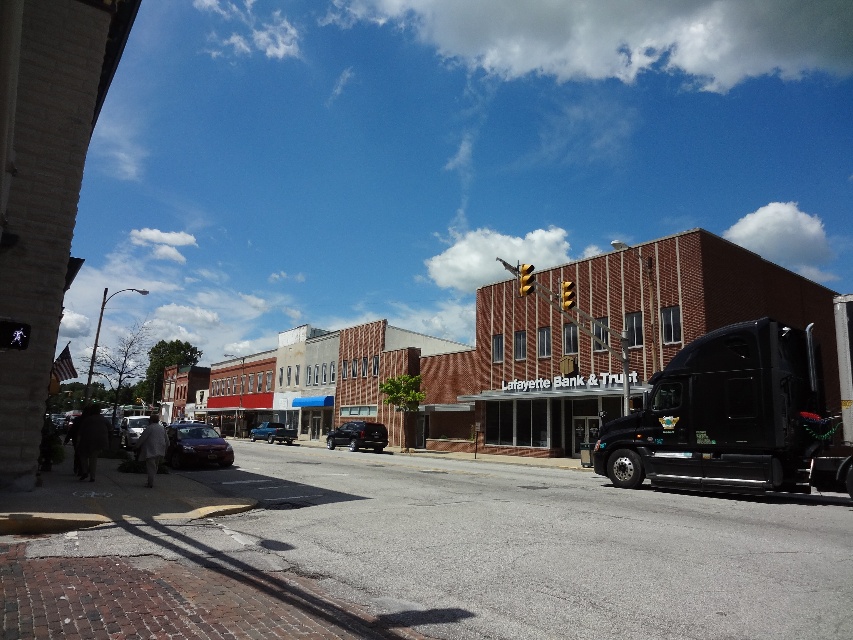
Can you confirm if satin black suv at center is positioned to the right of metallic blue truck at center?

Yes, satin black suv at center is to the right of metallic blue truck at center.

In the scene shown: Does satin black suv at center appear under metallic blue truck at center?

Actually, satin black suv at center is above metallic blue truck at center.

Measure the distance between point (337, 435) and camera.

Point (337, 435) and camera are 34.86 meters apart from each other.

Identify the location of satin black suv at center. This screenshot has height=640, width=853. (358, 435).

Looking at this image, who is positioned more to the left, shiny dark red sedan at center or shiny black sedan at lower left?

From the viewer's perspective, shiny black sedan at lower left appears more on the left side.

Does shiny dark red sedan at center have a lesser height compared to shiny black sedan at lower left?

Yes.

Image resolution: width=853 pixels, height=640 pixels. What do you see at coordinates (196, 445) in the screenshot?
I see `shiny dark red sedan at center` at bounding box center [196, 445].

Locate an element on the screen. shiny dark red sedan at center is located at coordinates (196, 445).

Can you confirm if black glossy trailer truck at right is thinner than metallic blue truck at center?

Yes.

Between black glossy trailer truck at right and metallic blue truck at center, which one is positioned lower?

metallic blue truck at center

Is point (692, 342) positioned after point (276, 435)?

No, (692, 342) is closer to viewer.

The image size is (853, 640). Identify the location of black glossy trailer truck at right. (730, 417).